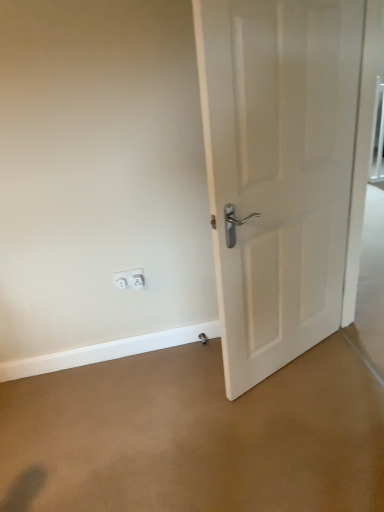
Identify the location of blank space to the left of white matte door at right. This screenshot has width=384, height=512. (192, 392).